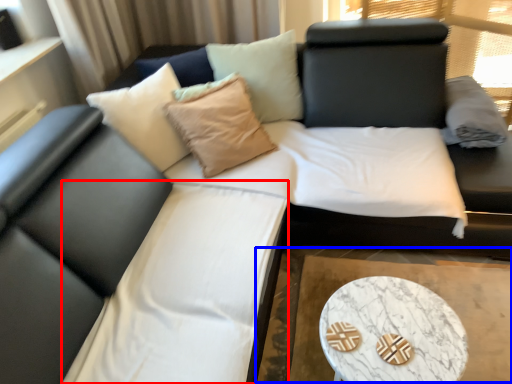
Question: Among these objects, which one is farthest to the camera, bedding (highlighted by a red box) or cocktail table (highlighted by a blue box)?

Choices:
 (A) bedding
 (B) cocktail table

Answer: (B)